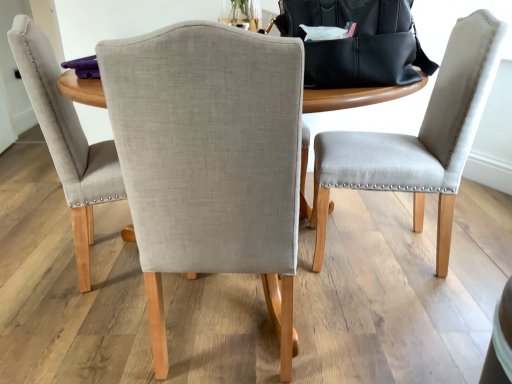
Where is `vacant space to the left of light gray fabric chair at center, the second chair in the right-to-left sequence`? This screenshot has width=512, height=384. vacant space to the left of light gray fabric chair at center, the second chair in the right-to-left sequence is located at coordinates (82, 333).